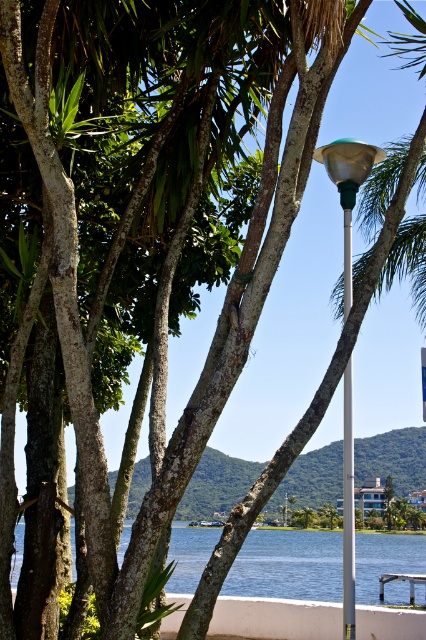
Question: Does wooden park bench at lower right appear under white plastic sign at upper center?

Choices:
 (A) yes
 (B) no

Answer: (A)

Question: Does green plastic pole at center have a lesser width compared to wooden park bench at lower right?

Choices:
 (A) no
 (B) yes

Answer: (B)

Question: Among these points, which one is farthest from the camera?

Choices:
 (A) (350, 545)
 (B) (350, 474)
 (C) (380, 541)

Answer: (C)

Question: Which of the following is the farthest from the observer?

Choices:
 (A) wooden park bench at lower right
 (B) white plastic sign at upper center
 (C) green plastic lamp post at upper center
 (D) blue water at lower center

Answer: (D)

Question: Which object is the closest to the white plastic sign at upper center?

Choices:
 (A) blue water at lower center
 (B) green plastic pole at center

Answer: (B)

Question: Does blue water at lower center have a larger size compared to wooden park bench at lower right?

Choices:
 (A) yes
 (B) no

Answer: (B)